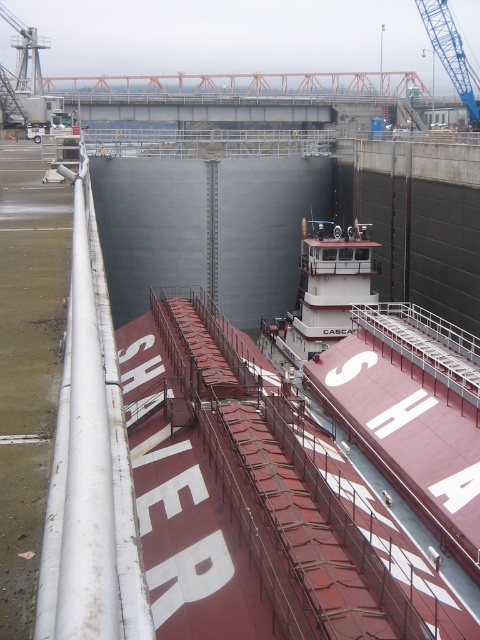
Is maroon matte barge at center closer to the viewer compared to white matte tugboat at center?

Yes, maroon matte barge at center is in front of white matte tugboat at center.

Is point (478, 417) farther from viewer compared to point (299, 314)?

No, it is not.

Locate an element on the screen. The height and width of the screenshot is (640, 480). maroon matte barge at center is located at coordinates (388, 380).